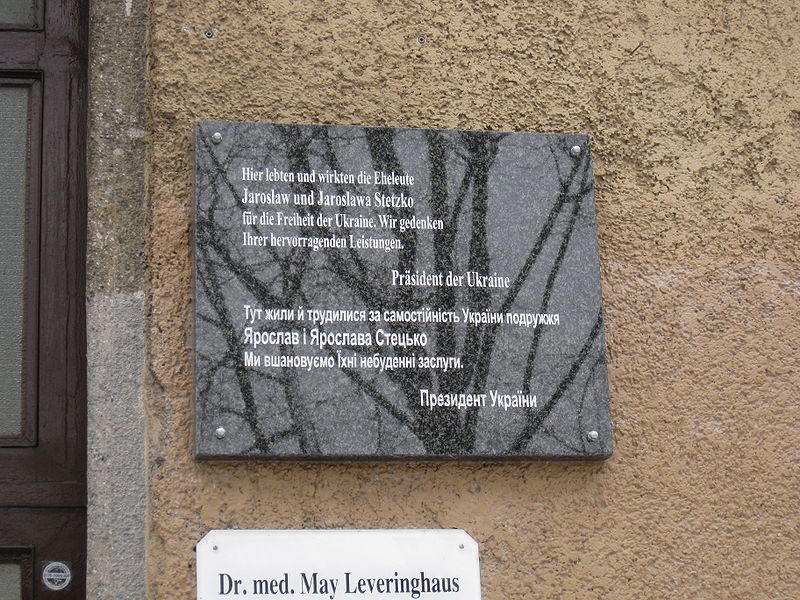
Find the location of a particular element. This screenshot has height=600, width=800. plaque with black tree design against gray is located at coordinates (554, 238).